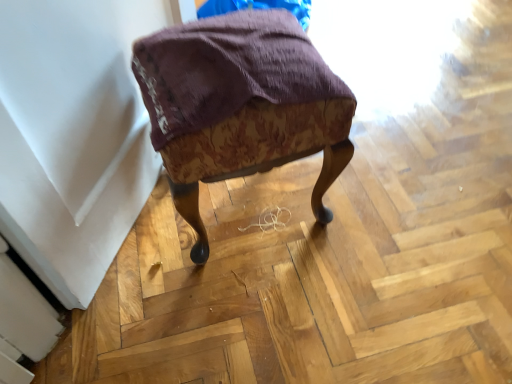
In order to click on vacant space to the right of patterned fabric stool at center in this screenshot , I will do click(390, 198).